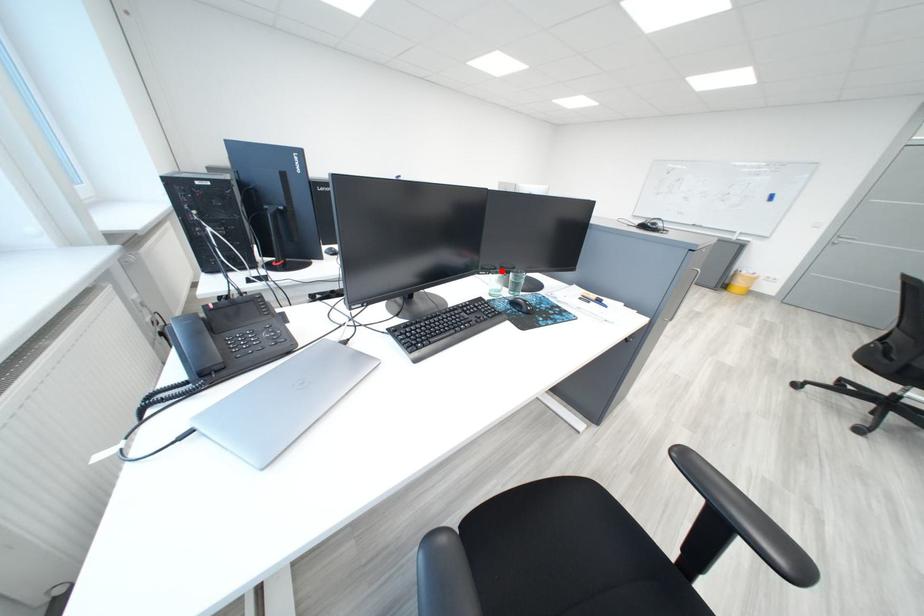
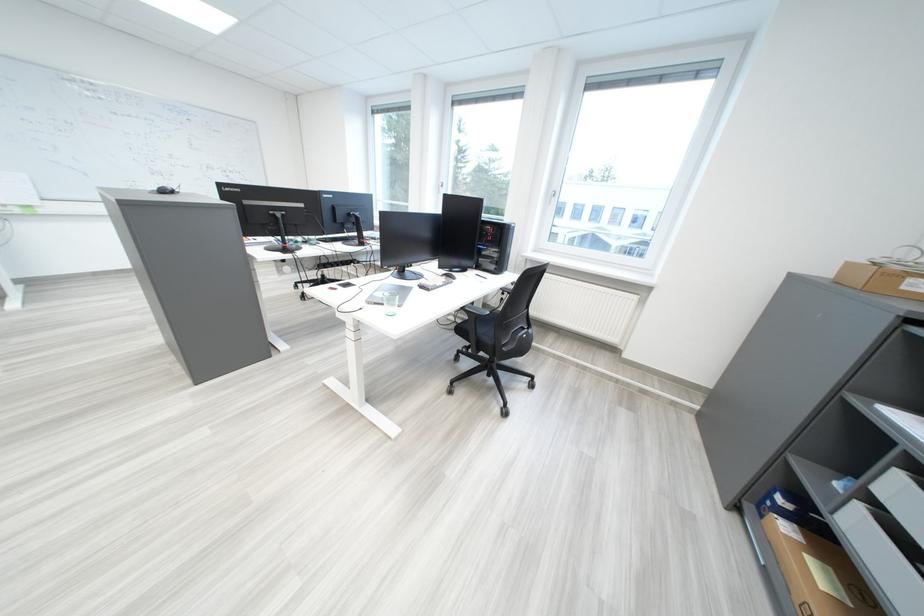
Question: I am providing you with two images of the same scene from different viewpoints. A red point is marked on the first image. Is the red point's position out of view in image 2?

Choices:
 (A) Yes
 (B) No

Answer: (A)